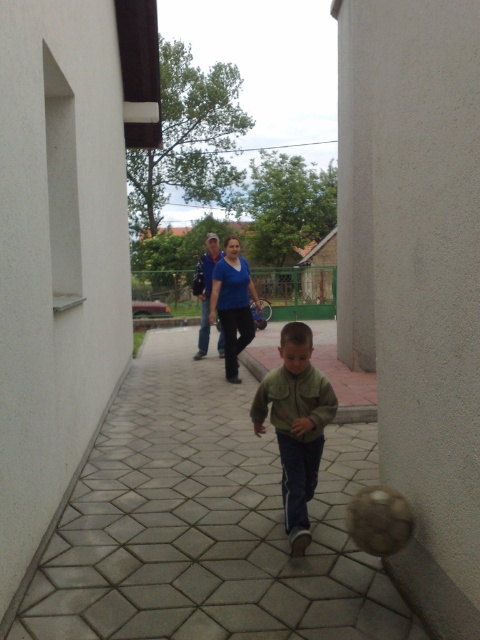
Question: Is gray hexagonal tiles at center bigger than green matte jacket at center?

Choices:
 (A) yes
 (B) no

Answer: (B)

Question: Can you confirm if gray hexagonal tiles at center is wider than green matte jacket at center?

Choices:
 (A) no
 (B) yes

Answer: (B)

Question: Which point is closer to the camera?

Choices:
 (A) (310, 348)
 (B) (128, 554)

Answer: (B)

Question: Which point is closer to the camera?

Choices:
 (A) green matte jacket at center
 (B) gray hexagonal tiles at center

Answer: (B)

Question: Does gray hexagonal tiles at center lie in front of green matte jacket at center?

Choices:
 (A) yes
 (B) no

Answer: (A)